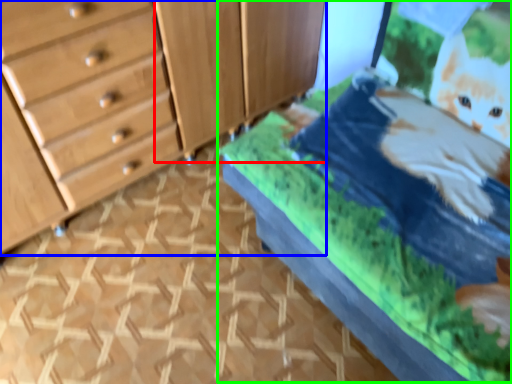
Question: Which is farther away from cabinetry (highlighted by a red box)? chest of drawers (highlighted by a blue box) or bed (highlighted by a green box)?

Choices:
 (A) chest of drawers
 (B) bed

Answer: (B)